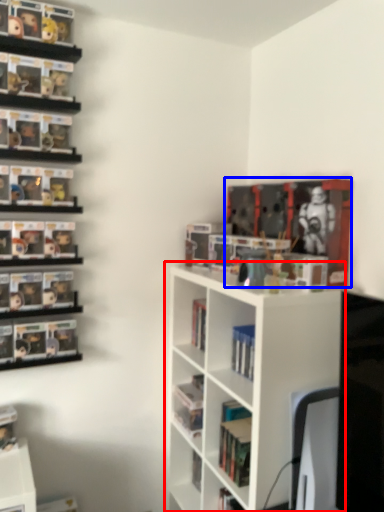
Question: Which of the following is the farthest to the observer, shelf (highlighted by a red box) or book (highlighted by a blue box)?

Choices:
 (A) shelf
 (B) book

Answer: (B)